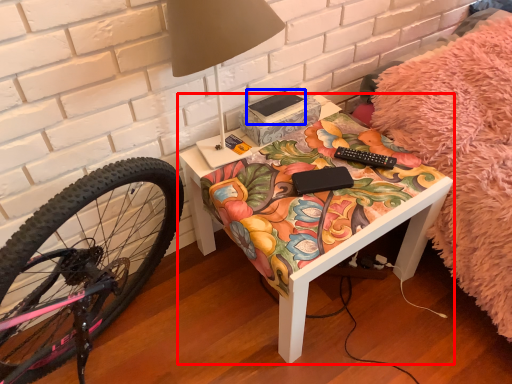
Question: Among these objects, which one is nearest to the camera, table (highlighted by a red box) or book (highlighted by a blue box)?

Choices:
 (A) table
 (B) book

Answer: (A)